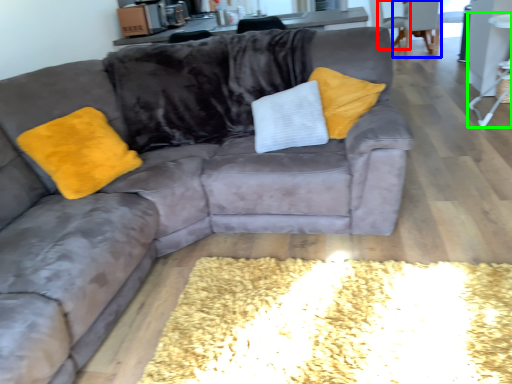
Question: Estimate the real-world distances between objects in this image. Which object is farther from armchair (highlighted by a red box), armchair (highlighted by a blue box) or side table (highlighted by a green box)?

Choices:
 (A) armchair
 (B) side table

Answer: (B)